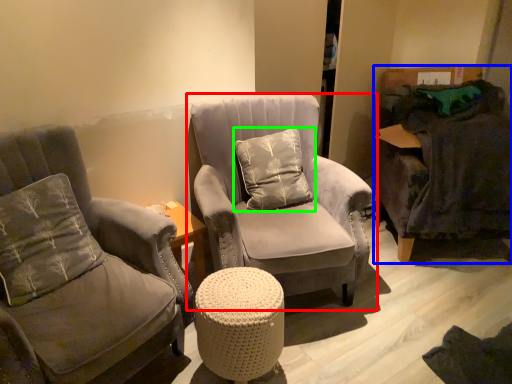
Question: Which object is the farthest from chair (highlighted by a red box)? Choose among these: swivel chair (highlighted by a blue box) or pillow (highlighted by a green box).

Choices:
 (A) swivel chair
 (B) pillow

Answer: (A)